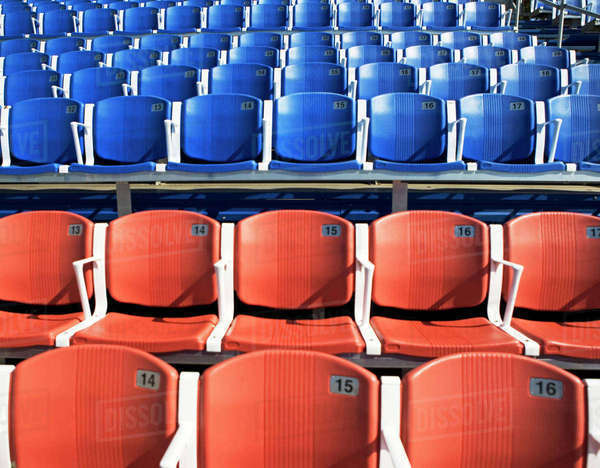
At what (x,y) coordinates should I click in order to perform the action: click on number tags on red chairs. Please return your answer as a coordinate pair (x, y). This screenshot has height=468, width=600. Looking at the image, I should click on (147, 382), (354, 378), (551, 385), (589, 230), (461, 227), (326, 228), (191, 225), (75, 229).